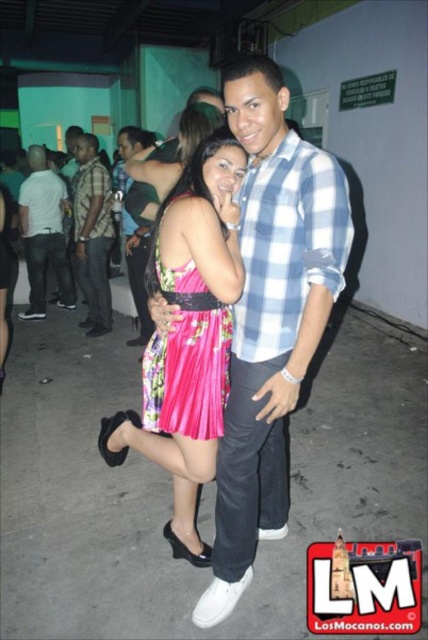
Question: Which point appears farthest from the camera in this image?

Choices:
 (A) (208, 324)
 (B) (262, 534)

Answer: (B)

Question: Is blue checkered shirt at center below pink floral dress at center?

Choices:
 (A) yes
 (B) no

Answer: (A)

Question: Which point is closer to the camera?

Choices:
 (A) blue checkered shirt at center
 (B) pink satin dress at center
 (C) brushed metal shirt at left
 (D) white matte shirt at left

Answer: (A)

Question: In this image, where is blue checkered shirt at center located relative to pink floral dress at center?

Choices:
 (A) above
 (B) below

Answer: (B)

Question: Considering the relative positions of blue checkered shirt at center and pink floral dress at center in the image provided, where is blue checkered shirt at center located with respect to pink floral dress at center?

Choices:
 (A) left
 (B) right

Answer: (B)

Question: Which is nearer to the pink floral dress at center?

Choices:
 (A) brushed metal shirt at left
 (B) white matte shirt at left
 (C) pink satin dress at center
 (D) blue checkered shirt at center

Answer: (C)